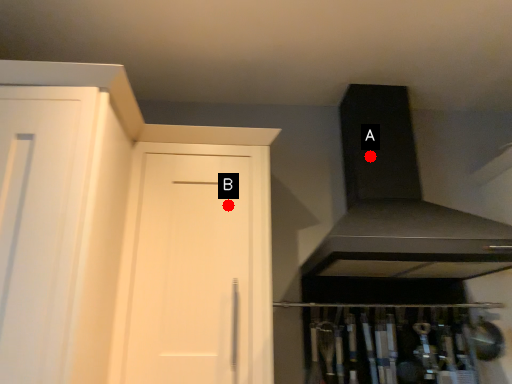
Question: Two points are circled on the image, labeled by A and B beside each circle. Which point appears farthest from the camera in this image?

Choices:
 (A) A is further
 (B) B is further

Answer: (A)